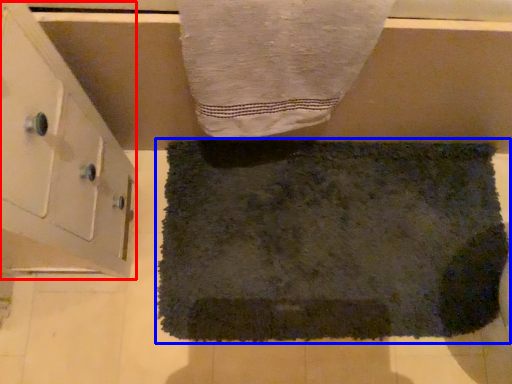
Question: Among these objects, which one is farthest to the camera, cabinetry (highlighted by a red box) or towel (highlighted by a blue box)?

Choices:
 (A) cabinetry
 (B) towel

Answer: (B)